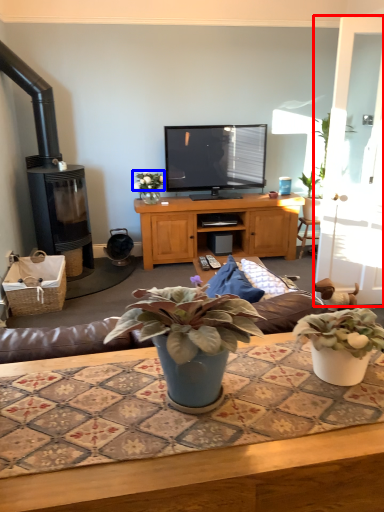
Question: Which point is closer to the camera, glass door (highlighted by a red box) or flower (highlighted by a blue box)?

Choices:
 (A) glass door
 (B) flower

Answer: (A)